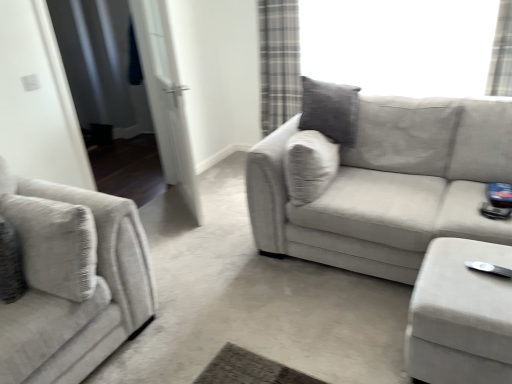
Question: From a real-world perspective, does white plastic wii controller at lower right stand above textured gray couch at left, placed as the 2th studio couch when sorted from right to left?

Choices:
 (A) yes
 (B) no

Answer: (B)

Question: Is textured gray couch at left, placed as the 2th studio couch when sorted from right to left, completely or partially inside white plastic wii controller at lower right?

Choices:
 (A) yes
 (B) no

Answer: (B)

Question: From a real-world perspective, is white plastic wii controller at lower right positioned under textured gray couch at left, placed as the 2th studio couch when sorted from right to left, based on gravity?

Choices:
 (A) no
 (B) yes

Answer: (B)

Question: From the image's perspective, is white plastic wii controller at lower right on top of textured gray couch at left, placed as the 2th studio couch when sorted from right to left?

Choices:
 (A) no
 (B) yes

Answer: (B)

Question: Is white plastic wii controller at lower right to the right of textured gray couch at left, placed as the 2th studio couch when sorted from right to left, from the viewer's perspective?

Choices:
 (A) no
 (B) yes

Answer: (B)

Question: Is textured beige couch at center, marked as the first studio couch in a right-to-left arrangement, taller or shorter than velvet beige ottoman at lower right?

Choices:
 (A) tall
 (B) short

Answer: (A)

Question: Is textured beige couch at center, which ranks as the second studio couch in left-to-right order, bigger or smaller than velvet beige ottoman at lower right?

Choices:
 (A) small
 (B) big

Answer: (B)

Question: From the image's perspective, is textured beige couch at center, which ranks as the second studio couch in left-to-right order, located above or below velvet beige ottoman at lower right?

Choices:
 (A) below
 (B) above

Answer: (B)

Question: From a real-world perspective, relative to velvet beige ottoman at lower right, is textured beige couch at center, which ranks as the second studio couch in left-to-right order, vertically above or below?

Choices:
 (A) below
 (B) above

Answer: (B)

Question: In the image, is white fabric screen door at left, which is the 2th screen door in right-to-left order, on the left side or the right side of white plastic wii controller at lower right?

Choices:
 (A) right
 (B) left

Answer: (B)

Question: From the image's perspective, is white fabric screen door at left, which is the 2th screen door in right-to-left order, located above or below white plastic wii controller at lower right?

Choices:
 (A) below
 (B) above

Answer: (B)

Question: Which is correct: white fabric screen door at left, positioned as the first screen door in left-to-right order, is inside white plastic wii controller at lower right, or outside of it?

Choices:
 (A) inside
 (B) outside

Answer: (B)

Question: In terms of width, does white fabric screen door at left, positioned as the first screen door in left-to-right order, look wider or thinner when compared to white plastic wii controller at lower right?

Choices:
 (A) thin
 (B) wide

Answer: (B)

Question: In terms of height, does white fabric screen door at left, positioned as the first screen door in left-to-right order, look taller or shorter compared to textured beige couch at center, which ranks as the second studio couch in left-to-right order?

Choices:
 (A) tall
 (B) short

Answer: (A)

Question: From the image's perspective, is white fabric screen door at left, positioned as the first screen door in left-to-right order, positioned above or below textured beige couch at center, marked as the first studio couch in a right-to-left arrangement?

Choices:
 (A) above
 (B) below

Answer: (A)